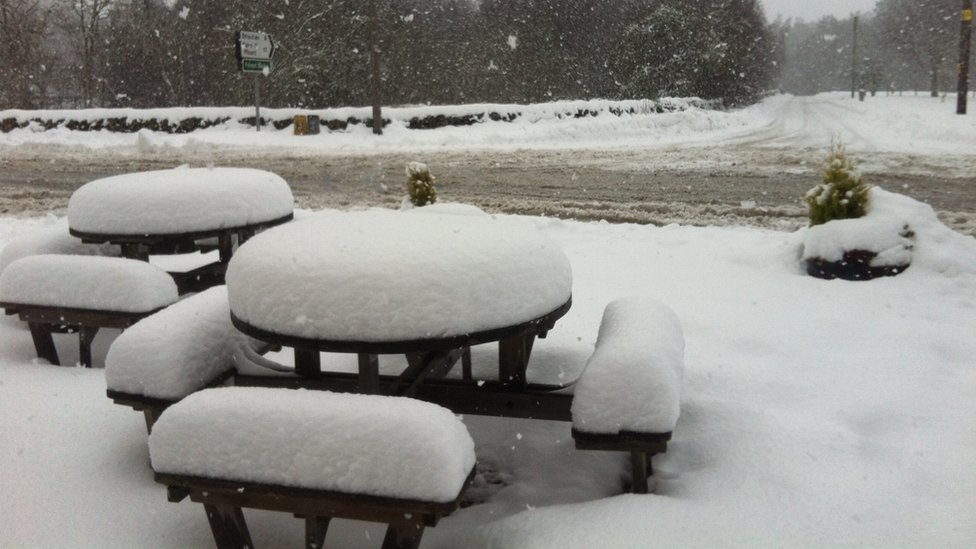
Image resolution: width=976 pixels, height=549 pixels. In order to click on bench in this screenshot , I will do `click(631, 435)`.